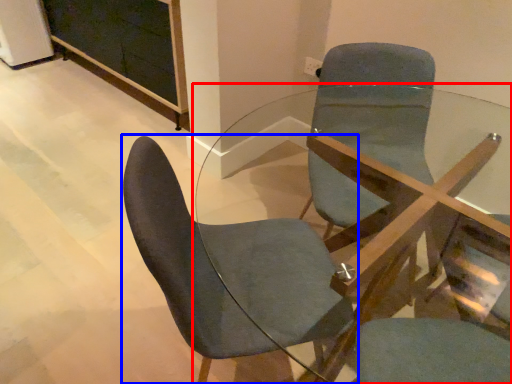
Question: Which point is further to the camera, table (highlighted by a red box) or chair (highlighted by a blue box)?

Choices:
 (A) table
 (B) chair

Answer: (B)